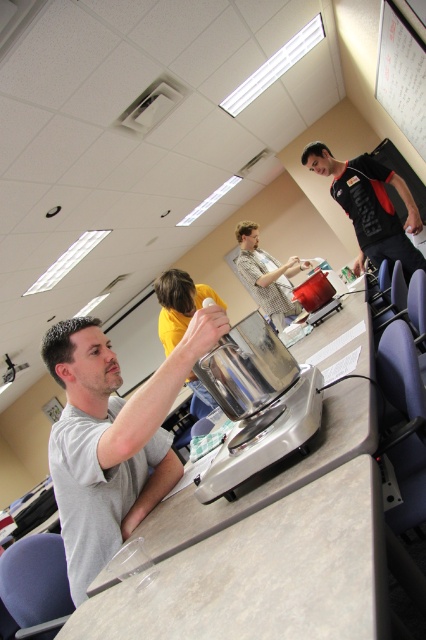
Is point (405, 45) in front of point (198, 394)?

Yes, it is.

The height and width of the screenshot is (640, 426). I want to click on white paperboard at upper right, so 402,74.

Does point (399, 113) come closer to viewer compared to point (178, 323)?

No, (399, 113) is behind (178, 323).

This screenshot has height=640, width=426. I want to click on white paperboard at upper right, so click(x=402, y=74).

Is metallic silver table at center closer to camera compared to yellow matte shirt at center?

Yes, metallic silver table at center is in front of yellow matte shirt at center.

Is the position of metallic silver table at center more distant than that of yellow matte shirt at center?

No, metallic silver table at center is in front of yellow matte shirt at center.

Who is more forward, (370, 358) or (172, 321)?

Positioned in front is point (370, 358).

Locate an element on the screen. The height and width of the screenshot is (640, 426). metallic silver table at center is located at coordinates (270, 474).

Is gray matte shirt at center behind black jersey at upper right?

No, gray matte shirt at center is in front of black jersey at upper right.

The image size is (426, 640). What are the coordinates of `gray matte shirt at center` in the screenshot? It's located at (112, 438).

Locate an element on the screen. gray matte shirt at center is located at coordinates (112, 438).